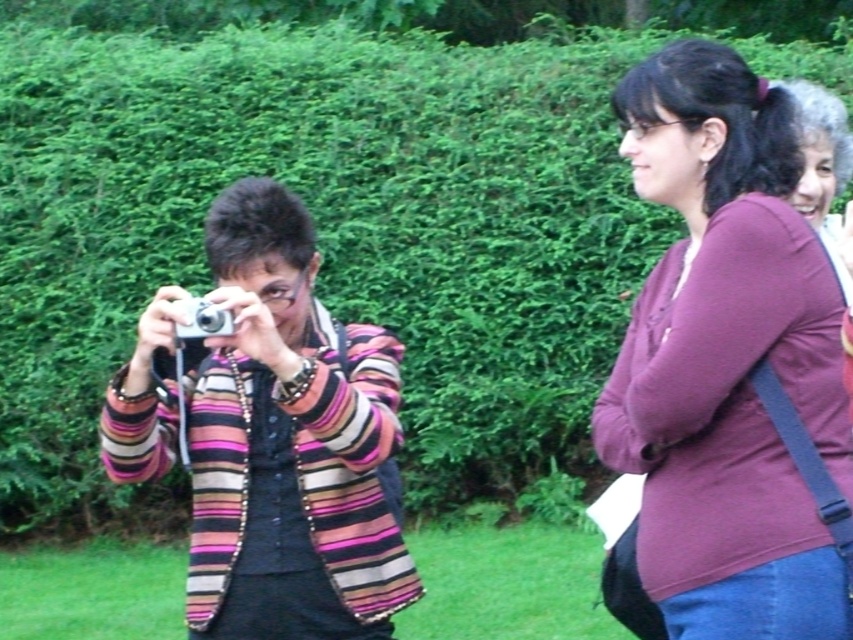
Is striped fabric camera at center positioned in front of maroon fabric shirt at right?

That is False.

Between striped fabric camera at center and maroon fabric shirt at right, which one has more height?

With more height is striped fabric camera at center.

In order to click on striped fabric camera at center in this screenshot , I will do `click(288, 444)`.

I want to click on striped fabric camera at center, so click(x=288, y=444).

Can you confirm if purple cotton shirt at upper right is taller than maroon fabric shirt at right?

Yes, purple cotton shirt at upper right is taller than maroon fabric shirt at right.

Is point (647, 465) less distant than point (815, 115)?

Yes, it is in front of point (815, 115).

The image size is (853, 640). What do you see at coordinates (724, 362) in the screenshot?
I see `purple cotton shirt at upper right` at bounding box center [724, 362].

Where is `purple cotton shirt at upper right`? This screenshot has height=640, width=853. purple cotton shirt at upper right is located at coordinates (724, 362).

Who is more forward, [802,412] or [200,324]?

Point [802,412] is in front.

Who is taller, purple cotton shirt at upper right or silver metallic camera at left?

purple cotton shirt at upper right

You are a GUI agent. You are given a task and a screenshot of the screen. Output one action in this format:
    pyautogui.click(x=<x>, y=<y>)
    Task: Click on the purple cotton shirt at upper right
    Image resolution: width=853 pixels, height=640 pixels.
    Given the screenshot: What is the action you would take?
    tap(724, 362)